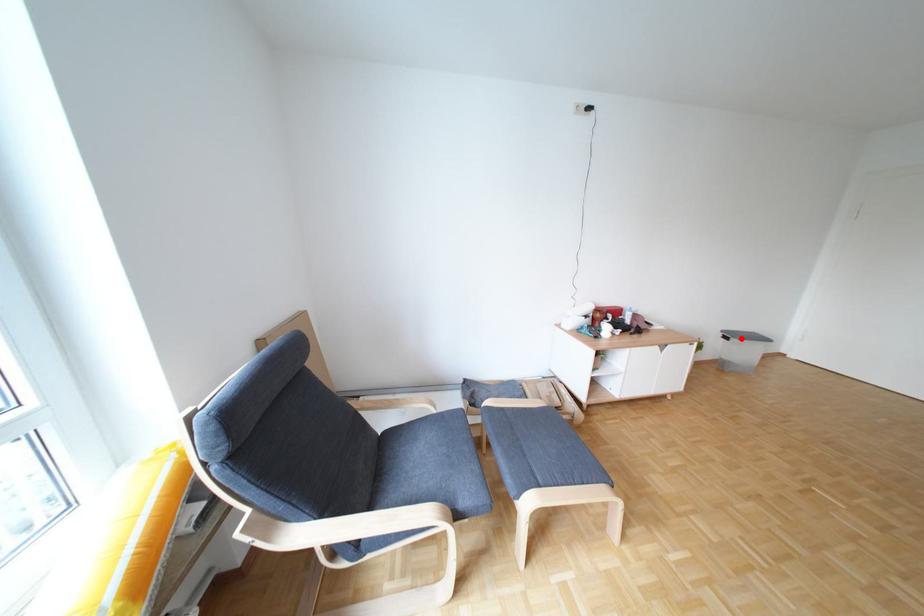
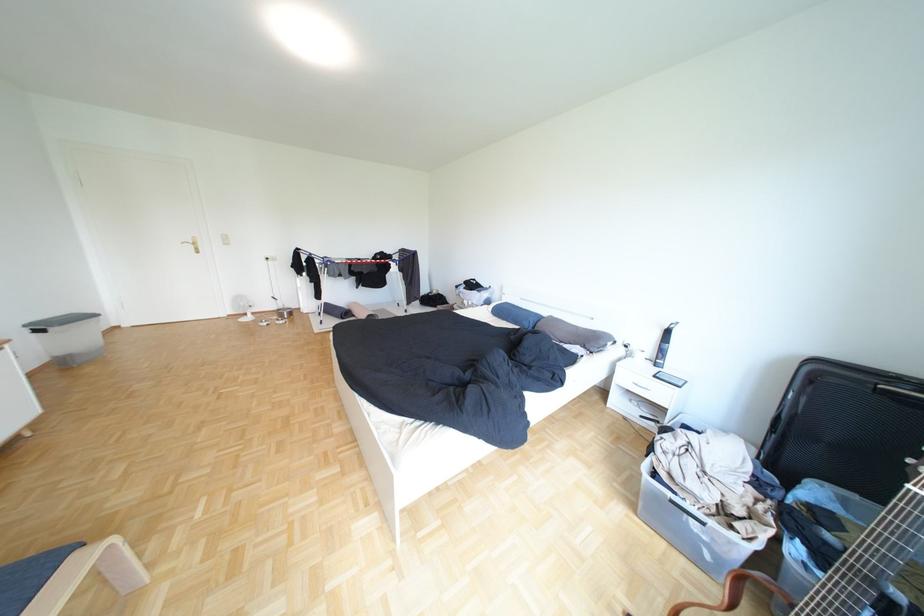
Where in the second image is the point corresponding to the highlighted location from the first image?

(55, 331)